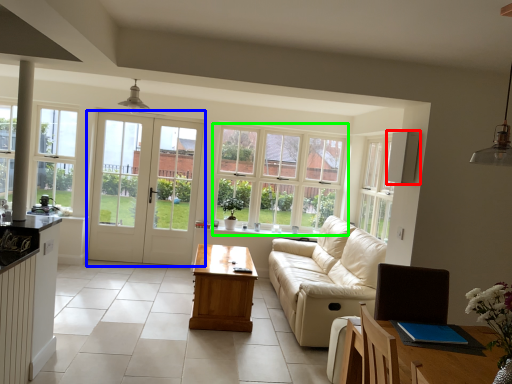
Question: Based on their relative distances, which object is nearer to appliance (highlighted by a red box)? Choose from door (highlighted by a blue box) and window (highlighted by a green box).

Choices:
 (A) door
 (B) window

Answer: (B)